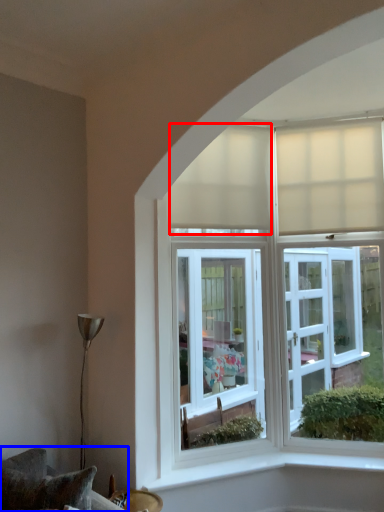
Question: Which point is closer to the camera, curtain (highlighted by a red box) or furniture (highlighted by a blue box)?

Choices:
 (A) curtain
 (B) furniture

Answer: (B)